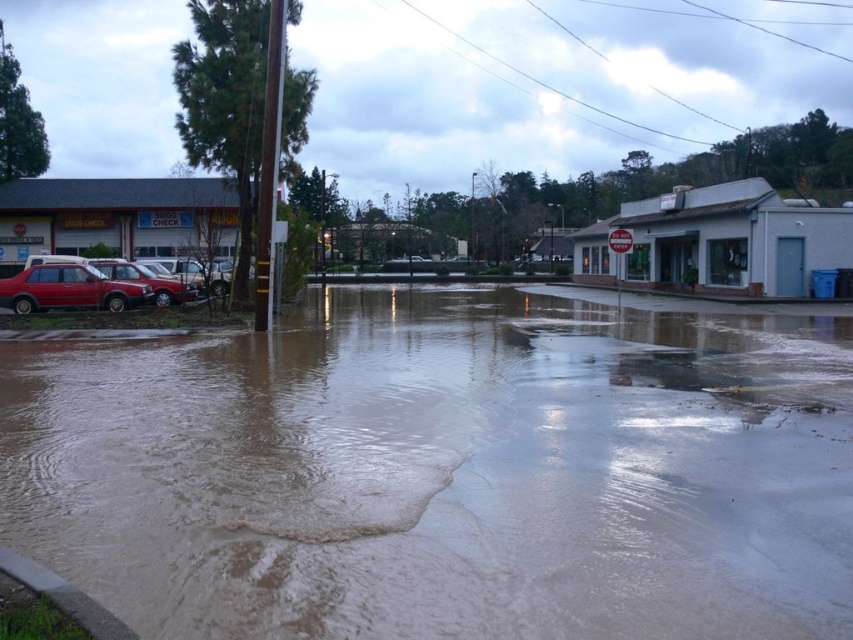
Does brown muddy water at center have a smaller size compared to matte red car at lower left?

Yes, brown muddy water at center is smaller than matte red car at lower left.

Is brown muddy water at center above matte red car at lower left?

Actually, brown muddy water at center is below matte red car at lower left.

What do you see at coordinates (445, 472) in the screenshot? I see `brown muddy water at center` at bounding box center [445, 472].

You are a GUI agent. You are given a task and a screenshot of the screen. Output one action in this format:
    pyautogui.click(x=<x>, y=<y>)
    Task: Click on the brown muddy water at center
    
    Given the screenshot: What is the action you would take?
    pyautogui.click(x=445, y=472)

Between matte red car at left and matte red car at lower left, which one has more height?

matte red car at lower left

What do you see at coordinates (68, 289) in the screenshot?
I see `matte red car at left` at bounding box center [68, 289].

You are a GUI agent. You are given a task and a screenshot of the screen. Output one action in this format:
    pyautogui.click(x=<x>, y=<y>)
    Task: Click on the matte red car at left
    The width and height of the screenshot is (853, 640).
    Given the screenshot: What is the action you would take?
    pyautogui.click(x=68, y=289)

Describe the element at coordinates (445, 472) in the screenshot. I see `brown muddy water at center` at that location.

Between point (788, 515) and point (120, 292), which one is positioned in front?

Point (788, 515)

Which is behind, point (508, 294) or point (20, 282)?

Point (508, 294)

Identify the location of brown muddy water at center. [445, 472].